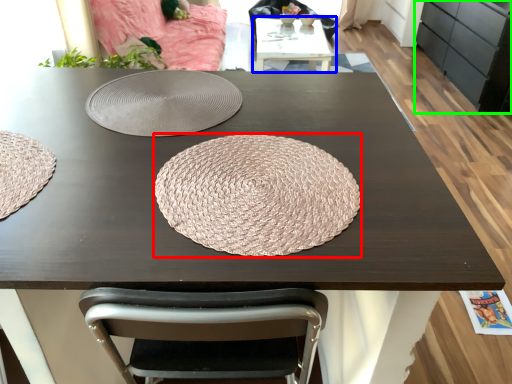
Question: Considering the real-world distances, which object is closest to mat (highlighted by a red box)? table (highlighted by a blue box) or cabinetry (highlighted by a green box).

Choices:
 (A) table
 (B) cabinetry

Answer: (A)